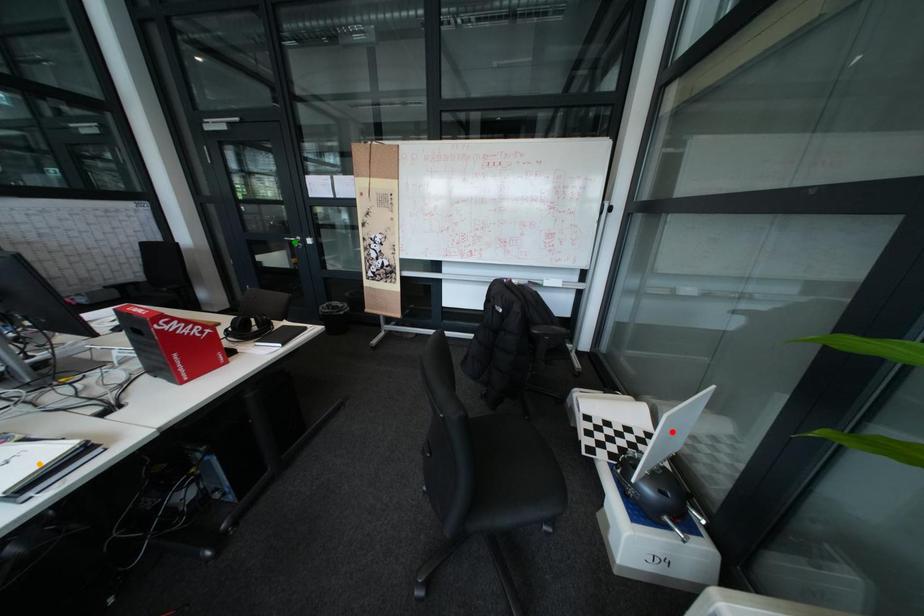
Order these from nearest to farthest:
- red point
- orange point
- green point

orange point, red point, green point